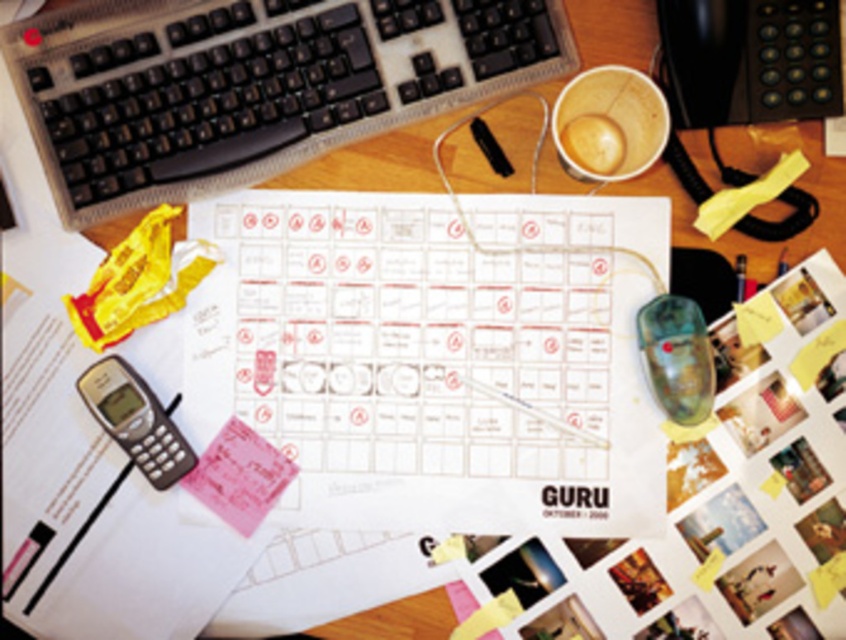
From the picture: Between black plastic keyboard at upper left and gray plastic phone at bottom left, which one appears on the left side from the viewer's perspective?

gray plastic phone at bottom left

Who is lower down, black plastic keyboard at upper left or gray plastic phone at bottom left?

gray plastic phone at bottom left is lower down.

The image size is (846, 640). What do you see at coordinates (251, 84) in the screenshot?
I see `black plastic keyboard at upper left` at bounding box center [251, 84].

Identify the location of black plastic keyboard at upper left. The width and height of the screenshot is (846, 640). [251, 84].